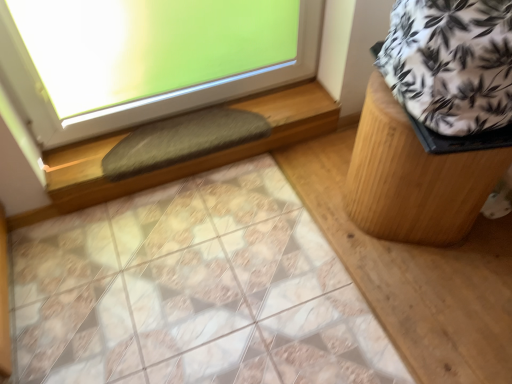
What do you see at coordinates (182, 140) in the screenshot?
I see `gray fuzzy mat at lower center` at bounding box center [182, 140].

Locate an element on the screen. This screenshot has width=512, height=384. white printed fabric at upper right is located at coordinates (451, 63).

The height and width of the screenshot is (384, 512). What do you see at coordinates (193, 159) in the screenshot? I see `green felt at upper left` at bounding box center [193, 159].

What is the approximate width of green felt at upper left?

9.43 inches.

The width and height of the screenshot is (512, 384). What are the coordinates of `gray fuzzy mat at lower center` in the screenshot? It's located at (x=182, y=140).

Between white printed fabric at upper right and wooden stool at right, which one has larger width?

white printed fabric at upper right is wider.

Considering the points (509, 109) and (470, 179), which point is in front, point (509, 109) or point (470, 179)?

The point (509, 109) is closer.

The height and width of the screenshot is (384, 512). Identify the location of blanket on the right of the wooden stool at right. (451, 63).

In terms of size, does white printed fabric at upper right appear bigger or smaller than wooden stool at right?

Clearly, white printed fabric at upper right is larger in size than wooden stool at right.

Can you confirm if green felt at upper left is positioned to the left of wooden stool at right?

Correct, you'll find green felt at upper left to the left of wooden stool at right.

Between point (274, 95) and point (369, 99), which one is positioned behind?

The point (274, 95) is more distant.

In terms of width, does green felt at upper left look wider or thinner when compared to wooden stool at right?

green felt at upper left is thinner than wooden stool at right.

Does green felt at upper left have a greater height compared to gray fuzzy mat at lower center?

Indeed, green felt at upper left has a greater height compared to gray fuzzy mat at lower center.

Which is less distant, (x=174, y=173) or (x=182, y=142)?

Clearly, point (x=174, y=173) is more distant from the camera than point (x=182, y=142).

Where is `doormat to the left of green felt at upper left`? The image size is (512, 384). doormat to the left of green felt at upper left is located at coordinates (182, 140).

Relative to gray fuzzy mat at lower center, is green felt at upper left in front or behind?

green felt at upper left is positioned closer to the viewer than gray fuzzy mat at lower center.

Is gray fuzzy mat at lower center aimed at wooden stool at right?

No, gray fuzzy mat at lower center is not turned towards wooden stool at right.

What's the angular difference between gray fuzzy mat at lower center and wooden stool at right's facing directions?

They differ by 89.8 degrees in their facing directions.

Can you confirm if gray fuzzy mat at lower center is shorter than wooden stool at right?

Indeed, gray fuzzy mat at lower center has a lesser height compared to wooden stool at right.

In the image, is green felt at upper left positioned in front of or behind white printed fabric at upper right?

Visually, green felt at upper left is located behind white printed fabric at upper right.

Does point (258, 99) come farther from viewer compared to point (470, 89)?

Yes, point (258, 99) is behind point (470, 89).

Considering the relative sizes of green felt at upper left and white printed fabric at upper right in the image provided, is green felt at upper left thinner than white printed fabric at upper right?

Indeed, green felt at upper left has a lesser width compared to white printed fabric at upper right.

Could you tell me if green felt at upper left is facing white printed fabric at upper right?

No, green felt at upper left is not facing towards white printed fabric at upper right.

Does wooden stool at right have a lesser width compared to white printed fabric at upper right?

Correct, the width of wooden stool at right is less than that of white printed fabric at upper right.

Based on the photo, which of these two, wooden stool at right or white printed fabric at upper right, is bigger?

white printed fabric at upper right.

Between point (390, 112) and point (423, 30), which one is positioned behind?

The point (390, 112) is farther.

Does wooden stool at right have a lesser height compared to white printed fabric at upper right?

No.

Looking at this image, in the image, is gray fuzzy mat at lower center on the left side or the right side of white printed fabric at upper right?

Clearly, gray fuzzy mat at lower center is on the left of white printed fabric at upper right in the image.

At what (x,y) coordinates should I click in order to perform the action: click on blanket on the right of gray fuzzy mat at lower center. Please return your answer as a coordinate pair (x, y). This screenshot has height=384, width=512. Looking at the image, I should click on (451, 63).

From a real-world perspective, is gray fuzzy mat at lower center under white printed fabric at upper right?

Yes, from a real-world perspective, gray fuzzy mat at lower center is beneath white printed fabric at upper right.

Is point (226, 133) behind point (431, 124)?

Yes, point (226, 133) is farther from viewer.

In order to click on furniture below the white printed fabric at upper right (from the image's perspective) in this screenshot , I will do `click(413, 178)`.

Locate an element on the screen. furniture located in front of the green felt at upper left is located at coordinates 413,178.

Estimate the real-world distances between objects in this image. Which object is closer to white printed fabric at upper right, green felt at upper left or gray fuzzy mat at lower center?

The object closer to white printed fabric at upper right is gray fuzzy mat at lower center.

From the image, which object appears to be nearer to gray fuzzy mat at lower center, green felt at upper left or wooden stool at right?

green felt at upper left is closer to gray fuzzy mat at lower center.

Looking at the image, which one is located closer to green felt at upper left, white printed fabric at upper right or gray fuzzy mat at lower center?

gray fuzzy mat at lower center is closer to green felt at upper left.

Looking at the image, which one is located further to green felt at upper left, wooden stool at right or white printed fabric at upper right?

Based on the image, white printed fabric at upper right appears to be further to green felt at upper left.

Based on their spatial positions, is wooden stool at right or gray fuzzy mat at lower center further from green felt at upper left?

wooden stool at right is further to green felt at upper left.

Estimate the real-world distances between objects in this image. Which object is further from wooden stool at right, white printed fabric at upper right or green felt at upper left?

Among the two, green felt at upper left is located further to wooden stool at right.

Considering their positions, is gray fuzzy mat at lower center positioned closer to green felt at upper left than wooden stool at right?

Among the two, gray fuzzy mat at lower center is located nearer to green felt at upper left.

Which object lies nearer to the anchor point white printed fabric at upper right, gray fuzzy mat at lower center or wooden stool at right?

Among the two, wooden stool at right is located nearer to white printed fabric at upper right.

Find the location of a particular element. window sill situated between gray fuzzy mat at lower center and wooden stool at right from left to right is located at coordinates (193, 159).

Locate an element on the screen. Image resolution: width=512 pixels, height=384 pixels. furniture situated between green felt at upper left and white printed fabric at upper right from left to right is located at coordinates (413, 178).

Where is `window sill between white printed fabric at upper right and gray fuzzy mat at lower center along the z-axis`? The width and height of the screenshot is (512, 384). window sill between white printed fabric at upper right and gray fuzzy mat at lower center along the z-axis is located at coordinates (193, 159).

I want to click on furniture between gray fuzzy mat at lower center and white printed fabric at upper right from left to right, so click(x=413, y=178).